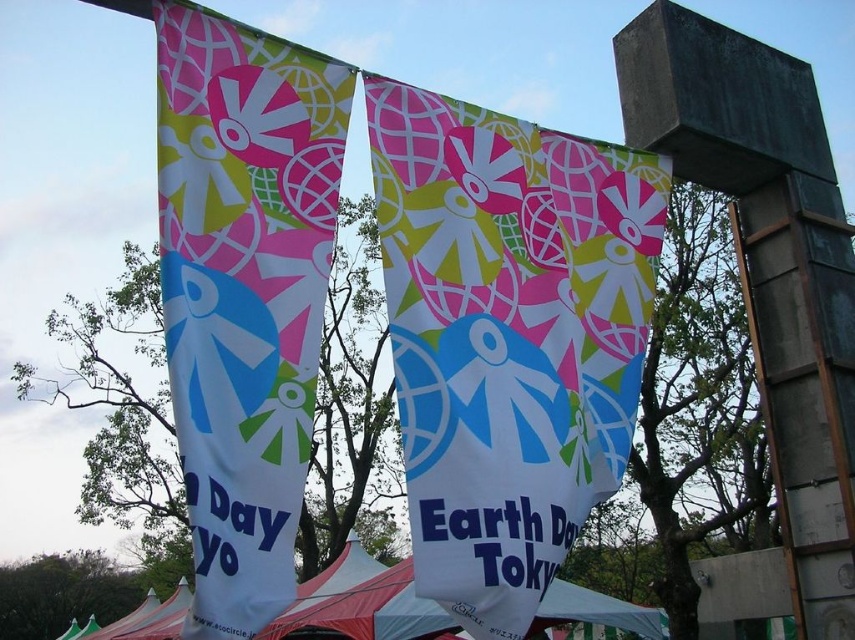
You are setting up a booth for an event and need to decide which object to place first. Based on their widths, which object should you place first, the matte fabric banner at center or the white fabric tent at lower center?

The matte fabric banner at center is thinner than the white fabric tent at lower center, so you should place the white fabric tent at lower center first since it is wider and might require more space.

Looking at this image, you are standing in front of the banners displayed at the Earth Day Tokyo event. The matte fabric banner at center is part of the display. Can you determine its exact position relative to the other elements in the scene?

The matte fabric banner at center is located at point coordinates (508, 337). This position places it centrally within the scene, aligning with the backdrop of trees and clear sky, as described in the scene context.

In the scene shown: You are at an Earth Day event in Tokyo and see the two large banners. The organizers want to place a new banner exactly at the point marked by the coordinates point (508, 337). Based on the scene description, which existing banner should you place the new banner next to?

The point (508, 337) marks the matte fabric banner at center, so the new banner should be placed next to the matte fabric banner at center.